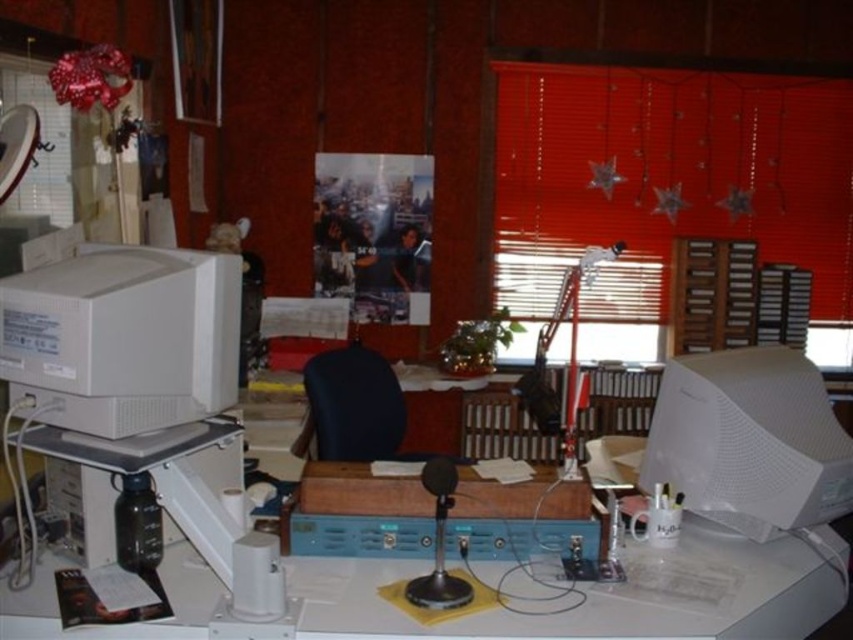
Question: Which object is farther from the camera taking this photo?

Choices:
 (A) white matte desktop computer at left
 (B) black leather chair at center

Answer: (B)

Question: Can you confirm if white matte desktop computer at left is positioned to the right of white matte computer monitor at right?

Choices:
 (A) no
 (B) yes

Answer: (A)

Question: Is white matte desktop computer at left above white matte computer monitor at right?

Choices:
 (A) yes
 (B) no

Answer: (A)

Question: Among these objects, which one is nearest to the camera?

Choices:
 (A) white matte computer monitor at right
 (B) black leather chair at center
 (C) white matte desktop computer at left

Answer: (C)

Question: Does white matte computer monitor at right come behind black leather chair at center?

Choices:
 (A) yes
 (B) no

Answer: (B)

Question: Which of the following is the farthest from the observer?

Choices:
 (A) white matte computer monitor at right
 (B) white matte desktop computer at left

Answer: (A)